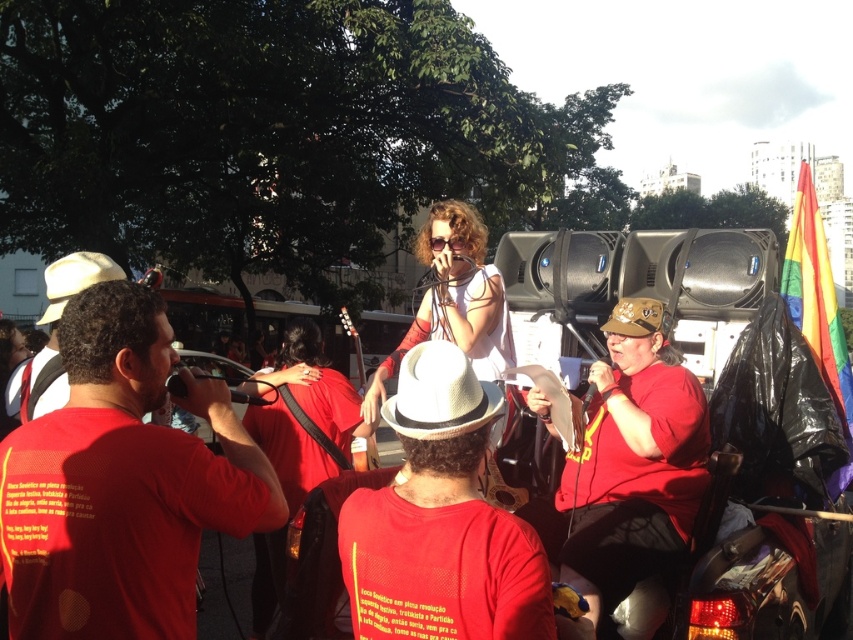
Question: Which object is farther from the camera taking this photo?

Choices:
 (A) matte red shirt at center
 (B) white matte cowboy hat at left

Answer: (B)

Question: Does white straw hat at center appear on the left side of white matte cowboy hat at left?

Choices:
 (A) no
 (B) yes

Answer: (A)

Question: Which of the following is the farthest from the observer?

Choices:
 (A) (283, 385)
 (B) (520, 547)
 (C) (47, 476)

Answer: (A)

Question: Is white straw hat at center to the left of matte white hat at left from the viewer's perspective?

Choices:
 (A) no
 (B) yes

Answer: (A)

Question: Is red matte shirt at center to the right of white matte cowboy hat at left from the viewer's perspective?

Choices:
 (A) no
 (B) yes

Answer: (B)

Question: Which is nearer to the white straw cowboy hat at center?

Choices:
 (A) matte red shirt at center
 (B) red matte shirt at left
 (C) matte white hat at left
 (D) white straw hat at center

Answer: (D)